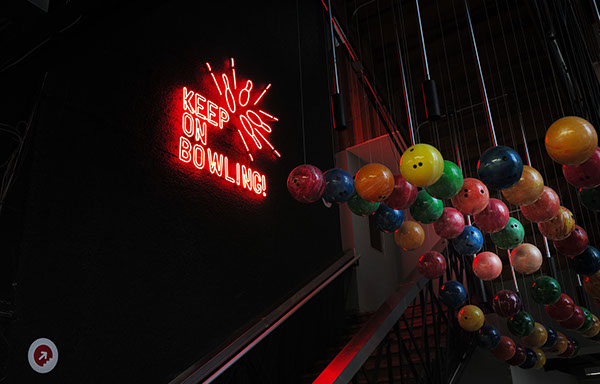
You are a GUI agent. You are given a task and a screenshot of the screen. Output one action in this format:
    pyautogui.click(x=<x>, y=<y>)
    Task: Click on the neon sign
    The image size is (600, 384).
    Given the screenshot: What is the action you would take?
    pyautogui.click(x=200, y=132)